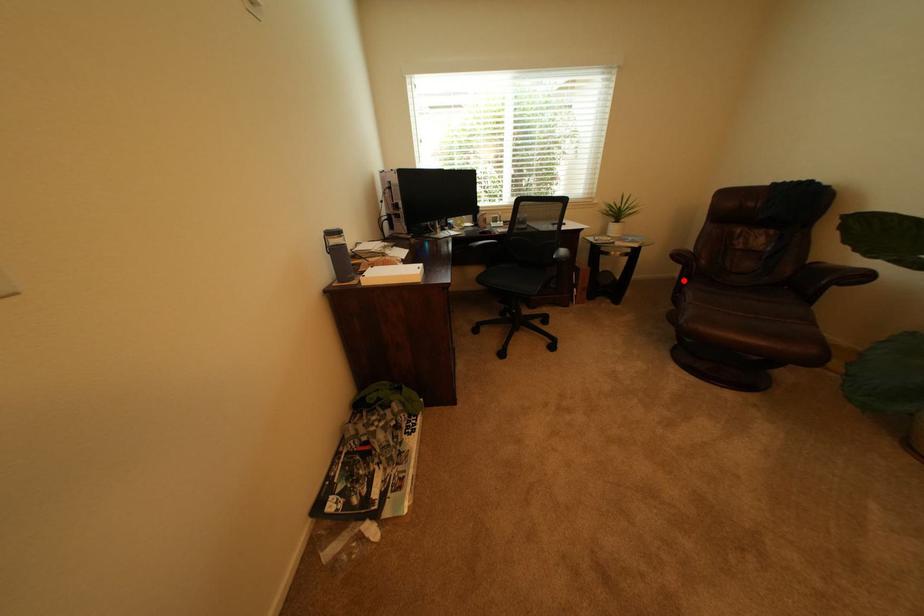
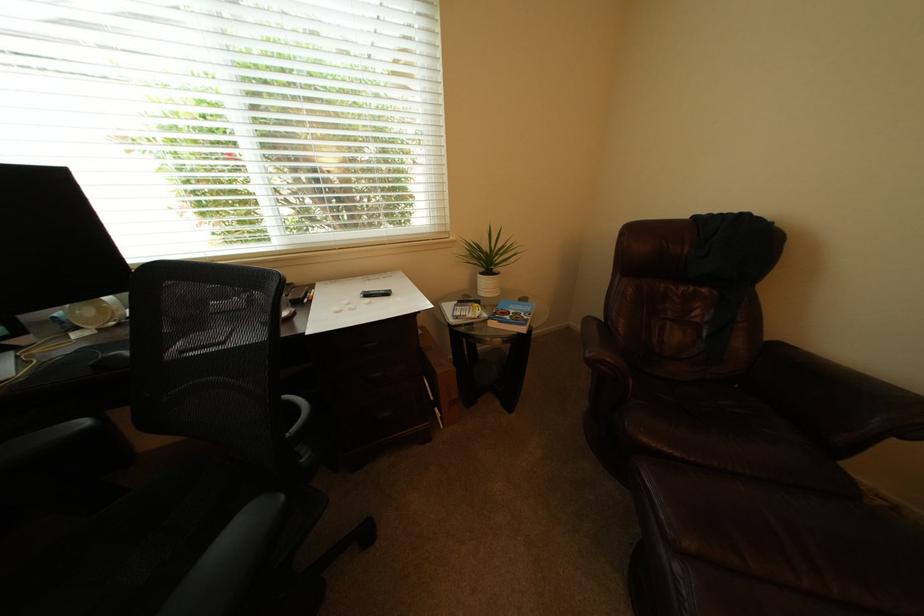
Question: I am providing you with two images of the same scene from different viewpoints. Image1 has a red point marked. In image2, the corresponding 3D location appears at what relative position? Reply with the corresponding letter.

Choices:
 (A) Closer
 (B) Farther

Answer: (A)